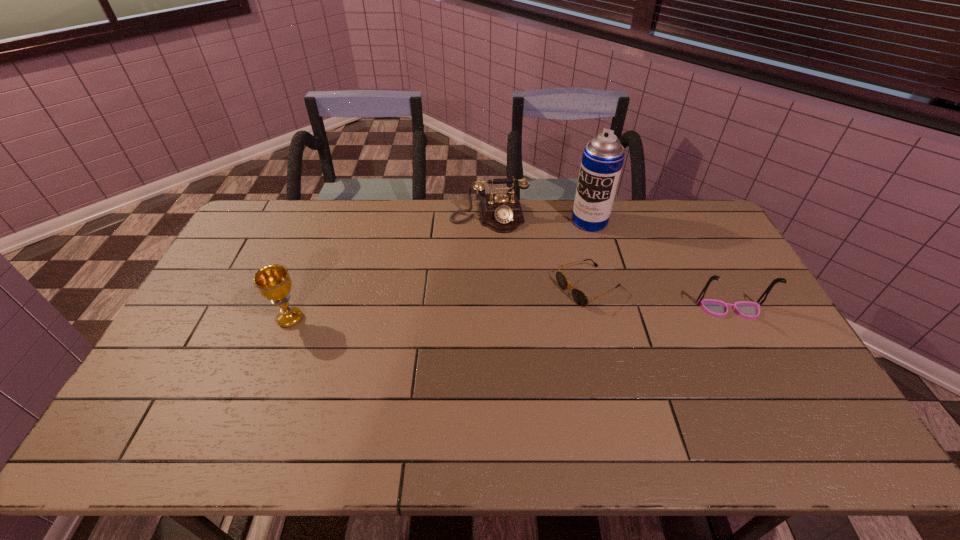
The height and width of the screenshot is (540, 960). Identify the location of free space between the telephone and the sunglasses. (539, 252).

Find the location of a particular element. free space between the tallest object and the second object from left to right is located at coordinates (540, 219).

You are a GUI agent. You are given a task and a screenshot of the screen. Output one action in this format:
    pyautogui.click(x=<x>, y=<y>)
    Task: Click on the free area in between the shortest object and the leftmost object
    
    Given the screenshot: What is the action you would take?
    pyautogui.click(x=440, y=303)

Locate an element on the screen. vacant point located between the sunglasses and the aerosol can is located at coordinates (588, 254).

Point out which object is positioned as the nearest to the aerosol can. Please provide its 2D coordinates. Your answer should be formatted as a tuple, i.e. [(x, y)], where the tuple contains the x and y coordinates of a point satisfying the conditions above.

[(502, 213)]

Locate which object is the third closest to the chalice. Please provide its 2D coordinates. Your answer should be formatted as a tuple, i.e. [(x, y)], where the tuple contains the x and y coordinates of a point satisfying the conditions above.

[(602, 160)]

Identify the location of vacant position in the image that satisfies the following two spatial constraints: 1. on the back side of the chalice; 2. on the left side of the rightmost object. (294, 310).